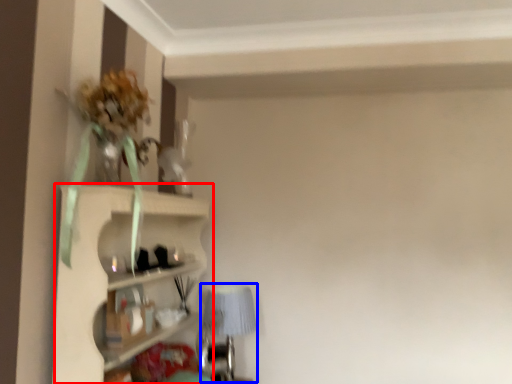
Question: Which point is further to the camera, shelf (highlighted by a red box) or table lamp (highlighted by a blue box)?

Choices:
 (A) shelf
 (B) table lamp

Answer: (B)